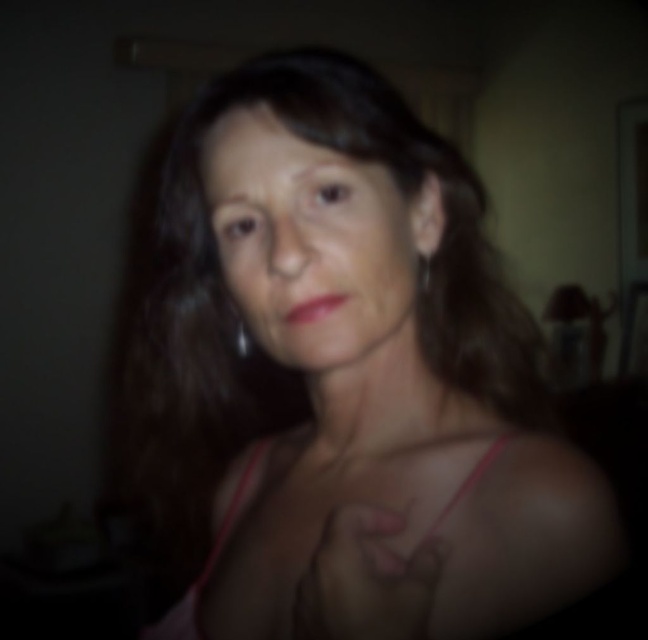
You are a photographer adjusting the camera focus. You need to ensure that both the pink fabric dress at center and the silver metallic earring at upper right are in focus. Given their positions, which object should you focus on first to achieve this?

The pink fabric dress at center is taller than the silver metallic earring at upper right. To ensure both are in focus, you should focus on the pink fabric dress at center first, as it is closer to the camera and adjusting focus from closer to farther objects often helps in achieving sharpness across different distances.

Please describe the exact position of the pink fabric at center in the image using a coordinate system where the bottom left corner is the origin point. The coordinate values are normalized between 0 and 1. For example, the center of the image would be at coordinates approximately 0.5,0.5. Please provide the coordinates as a pair of numbers separated by a comma.

The pink fabric at center is located at coordinates (x=345, y=378) in the image.

You are an interior designer analyzing the composition of this indoor portrait. The image has a focal point at point (345, 378). Which object in the scene is positioned exactly at that coordinate?

The pink fabric at center is located at point (345, 378).